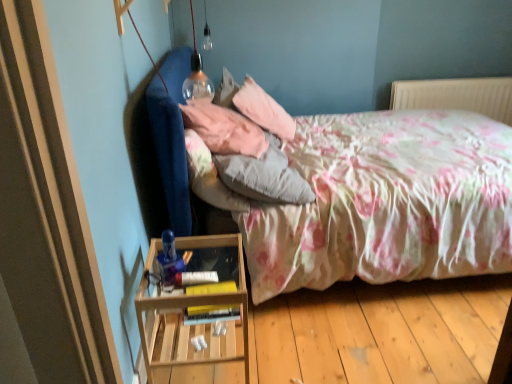
Question: Could you tell me if wooden at left is turned towards fluffy white pillow at center, which ranks as the 3th pillow in back-to-front order?

Choices:
 (A) yes
 (B) no

Answer: (B)

Question: Is wooden at left at the right side of fluffy white pillow at center, which is the first pillow in front-to-back order?

Choices:
 (A) no
 (B) yes

Answer: (A)

Question: Is wooden at left positioned in front of fluffy white pillow at center, which is the first pillow in front-to-back order?

Choices:
 (A) no
 (B) yes

Answer: (B)

Question: Is wooden at left to the left of fluffy white pillow at center, which is the first pillow in front-to-back order, from the viewer's perspective?

Choices:
 (A) no
 (B) yes

Answer: (B)

Question: Does wooden at left have a larger size compared to fluffy white pillow at center, which is the first pillow in front-to-back order?

Choices:
 (A) yes
 (B) no

Answer: (A)

Question: Is wooden at left wider than fluffy white pillow at center, which is the first pillow in front-to-back order?

Choices:
 (A) no
 (B) yes

Answer: (B)

Question: Is pink soft pillow at upper center, the 3th pillow in the front-to-back sequence, in front of pink fabric pillow at upper center, the 2th pillow in the back-to-front sequence?

Choices:
 (A) yes
 (B) no

Answer: (B)

Question: Can you confirm if pink soft pillow at upper center, placed as the first pillow when sorted from back to front, is wider than pink fabric pillow at upper center, the 2th pillow in the back-to-front sequence?

Choices:
 (A) yes
 (B) no

Answer: (A)

Question: Is pink soft pillow at upper center, placed as the first pillow when sorted from back to front, beside pink fabric pillow at upper center, the 2th pillow in the back-to-front sequence?

Choices:
 (A) yes
 (B) no

Answer: (B)

Question: From a real-world perspective, does pink soft pillow at upper center, the 3th pillow in the front-to-back sequence, sit lower than pink fabric pillow at upper center, the 2th pillow in the front-to-back sequence?

Choices:
 (A) no
 (B) yes

Answer: (B)

Question: Considering the relative sizes of pink soft pillow at upper center, the 3th pillow in the front-to-back sequence, and pink fabric pillow at upper center, the 2th pillow in the back-to-front sequence, in the image provided, is pink soft pillow at upper center, the 3th pillow in the front-to-back sequence, smaller than pink fabric pillow at upper center, the 2th pillow in the back-to-front sequence,?

Choices:
 (A) yes
 (B) no

Answer: (B)

Question: Can you confirm if pink soft pillow at upper center, the 3th pillow in the front-to-back sequence, is shorter than pink fabric pillow at upper center, the 2th pillow in the front-to-back sequence?

Choices:
 (A) yes
 (B) no

Answer: (B)

Question: Is pink fabric pillow at upper center, the 2th pillow in the back-to-front sequence, bigger than pink soft pillow at upper center, the 3th pillow in the front-to-back sequence?

Choices:
 (A) no
 (B) yes

Answer: (A)